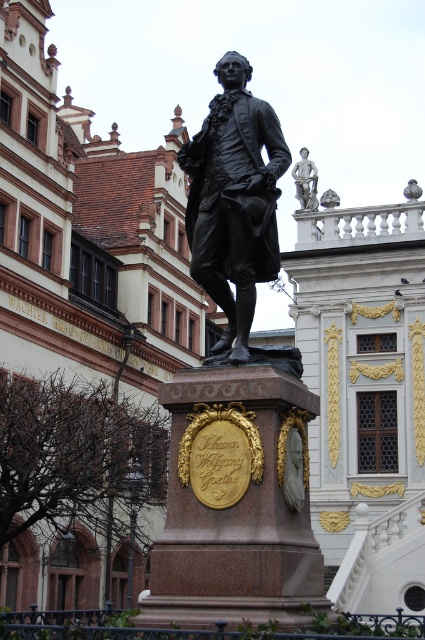
Is bronze statue at center wider than polished bronze statue at upper right?

Indeed, bronze statue at center has a greater width compared to polished bronze statue at upper right.

Is bronze statue at center smaller than polished bronze statue at upper right?

Incorrect, bronze statue at center is not smaller in size than polished bronze statue at upper right.

Find the location of a particular element. This screenshot has width=425, height=640. bronze statue at center is located at coordinates (234, 198).